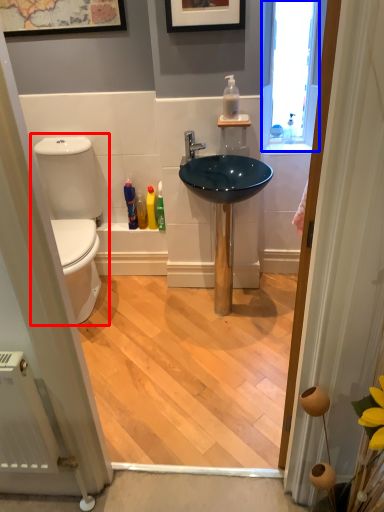
Question: Which point is closer to the camera, toilet (highlighted by a red box) or window (highlighted by a blue box)?

Choices:
 (A) toilet
 (B) window

Answer: (A)